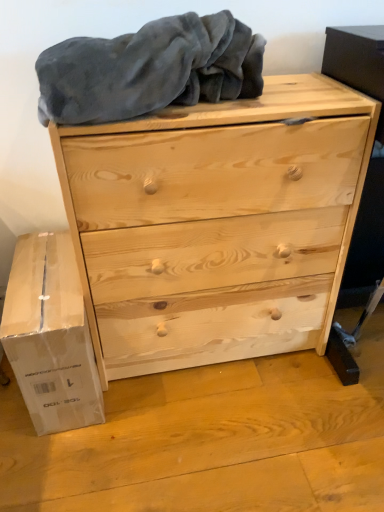
Question: Considering their positions, is white cardboard box at lower left located in front of or behind gray soft blanket at upper center?

Choices:
 (A) behind
 (B) front

Answer: (A)

Question: From the image's perspective, is white cardboard box at lower left positioned above or below gray soft blanket at upper center?

Choices:
 (A) above
 (B) below

Answer: (B)

Question: Estimate the real-world distances between objects in this image. Which object is closer to the natural wood chest of drawers at center?

Choices:
 (A) gray soft blanket at upper center
 (B) white cardboard box at lower left

Answer: (A)

Question: Based on their relative distances, which object is farther from the gray soft blanket at upper center?

Choices:
 (A) natural wood chest of drawers at center
 (B) white cardboard box at lower left

Answer: (B)